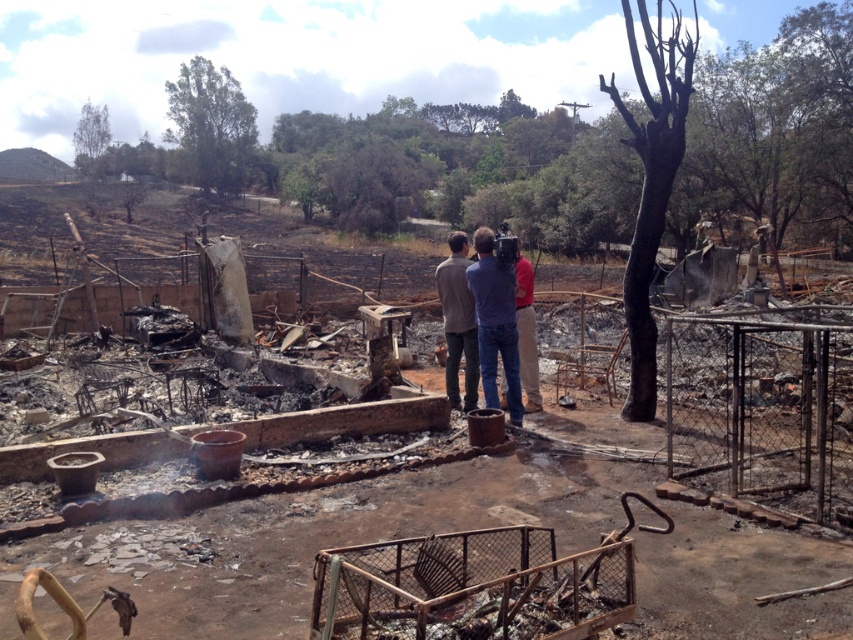
Does charcoal ash debris at center have a lesser height compared to matte gray jacket at center?

Indeed, charcoal ash debris at center has a lesser height compared to matte gray jacket at center.

Is charcoal ash debris at center to the right of matte gray jacket at center from the viewer's perspective?

Incorrect, charcoal ash debris at center is not on the right side of matte gray jacket at center.

Find the location of a particular element. This screenshot has width=853, height=640. charcoal ash debris at center is located at coordinates (437, 532).

How distant is charcoal ash debris at center from gray fabric jacket at center?

7.71 feet

Locate an element on the screen. This screenshot has height=640, width=853. charcoal ash debris at center is located at coordinates (437, 532).

Who is taller, matte gray jacket at center or gray fabric jacket at center?

With more height is matte gray jacket at center.

Does matte gray jacket at center have a smaller size compared to gray fabric jacket at center?

Indeed, matte gray jacket at center has a smaller size compared to gray fabric jacket at center.

Who is more forward, (503, 321) or (457, 300)?

Point (503, 321) is more forward.

At what (x,y) coordinates should I click in order to perform the action: click on matte gray jacket at center. Please return your answer as a coordinate pair (x, y). This screenshot has width=853, height=640. Looking at the image, I should click on (495, 323).